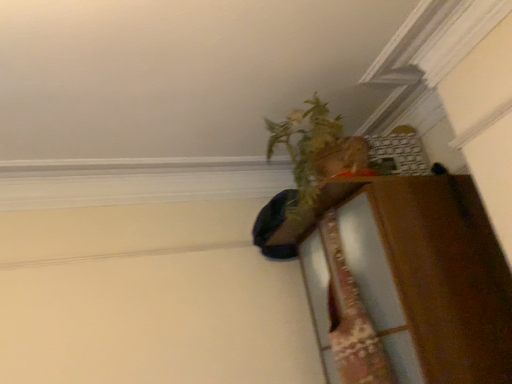
Question: Is point (315, 117) closer or farther from the camera than point (340, 243)?

Choices:
 (A) closer
 (B) farther

Answer: (A)

Question: Looking at the image, does green leafy plant at upper right seem bigger or smaller compared to wooden dresser at right?

Choices:
 (A) big
 (B) small

Answer: (B)

Question: Is green leafy plant at upper right wider or thinner than wooden dresser at right?

Choices:
 (A) wide
 (B) thin

Answer: (B)

Question: Is wooden dresser at right in front of or behind green leafy plant at upper right in the image?

Choices:
 (A) behind
 (B) front

Answer: (B)

Question: Is wooden dresser at right bigger or smaller than green leafy plant at upper right?

Choices:
 (A) small
 (B) big

Answer: (B)

Question: Looking at their shapes, would you say wooden dresser at right is wider or thinner than green leafy plant at upper right?

Choices:
 (A) thin
 (B) wide

Answer: (B)

Question: From a real-world perspective, relative to green leafy plant at upper right, is wooden dresser at right vertically above or below?

Choices:
 (A) above
 (B) below

Answer: (B)